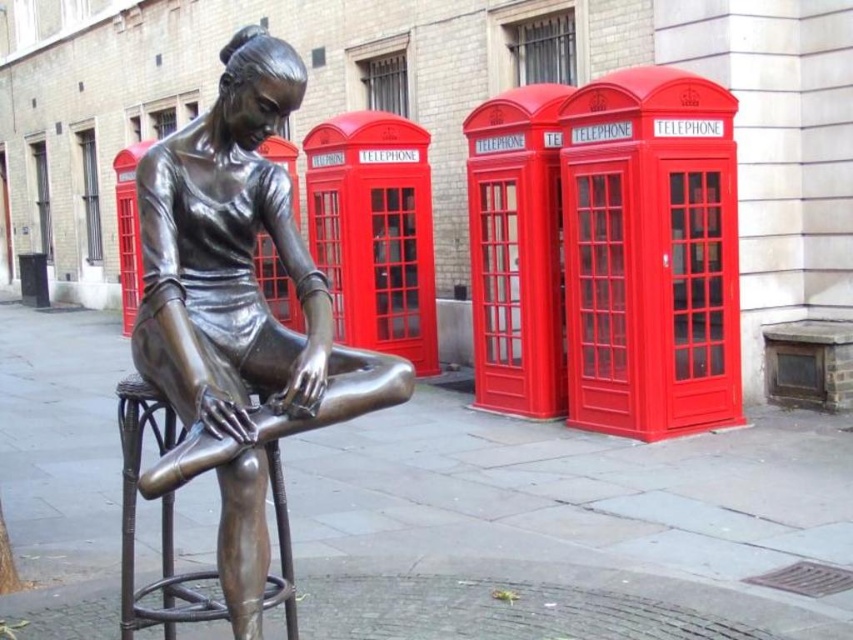
Can you confirm if bronze statue at center is wider than bronze textured bar stool at center?

Indeed, bronze statue at center has a greater width compared to bronze textured bar stool at center.

Which is more to the right, bronze statue at center or bronze textured bar stool at center?

bronze statue at center

This screenshot has width=853, height=640. What do you see at coordinates (239, 310) in the screenshot?
I see `bronze statue at center` at bounding box center [239, 310].

You are a GUI agent. You are given a task and a screenshot of the screen. Output one action in this format:
    pyautogui.click(x=<x>, y=<y>)
    Task: Click on the bronze statue at center
    
    Given the screenshot: What is the action you would take?
    pyautogui.click(x=239, y=310)